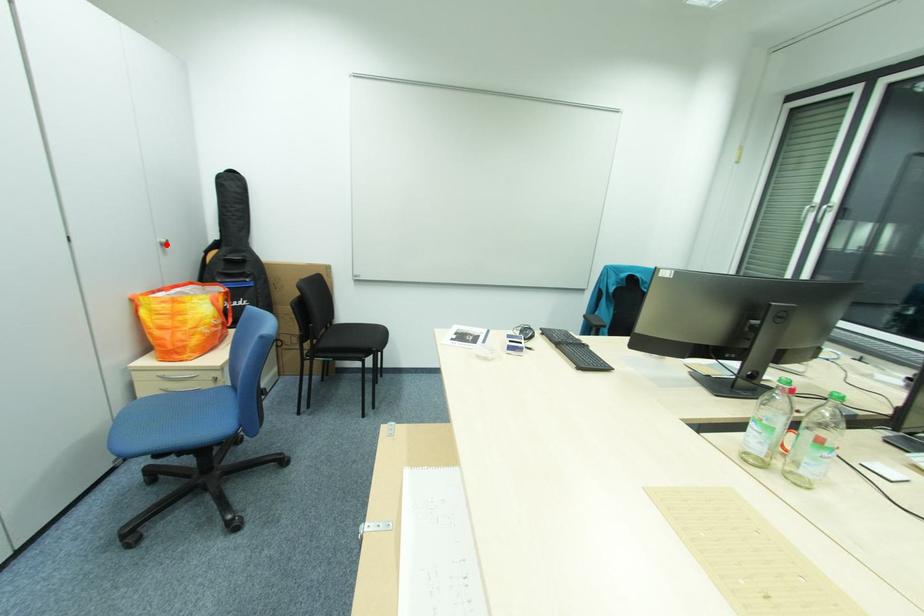
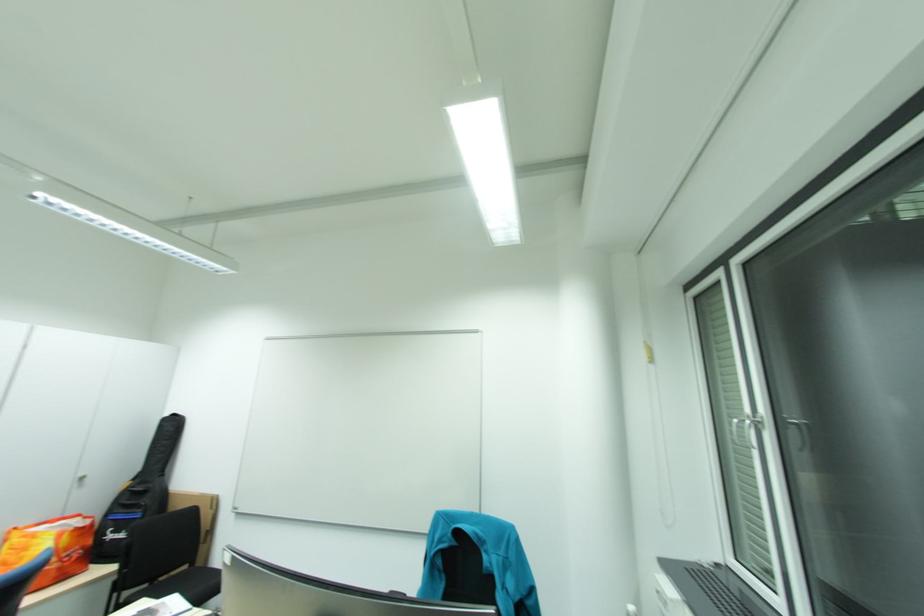
Question: I am providing you with two images of the same scene from different viewpoints. Given a red point in image1, look at the same physical point in image2. Is it:

Choices:
 (A) Closer to the viewpoint
 (B) Farther from the viewpoint

Answer: (A)